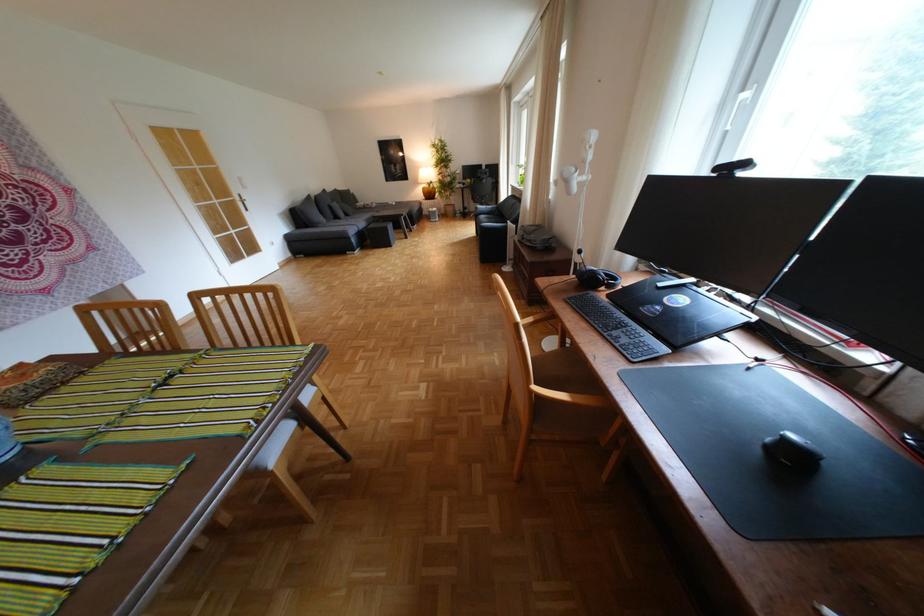
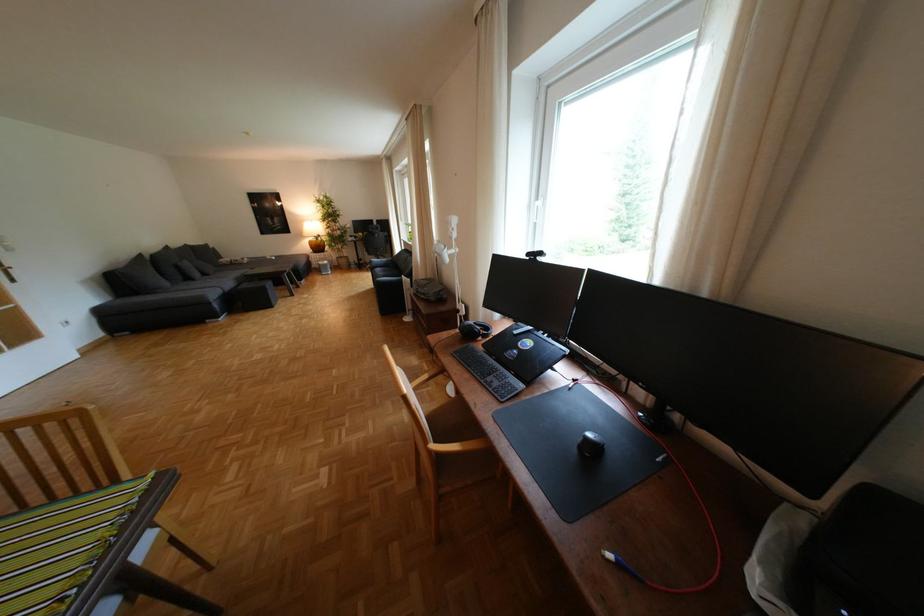
The images are taken continuously from a first-person perspective. In which direction are you moving?

The cameraman moved toward right, backward.